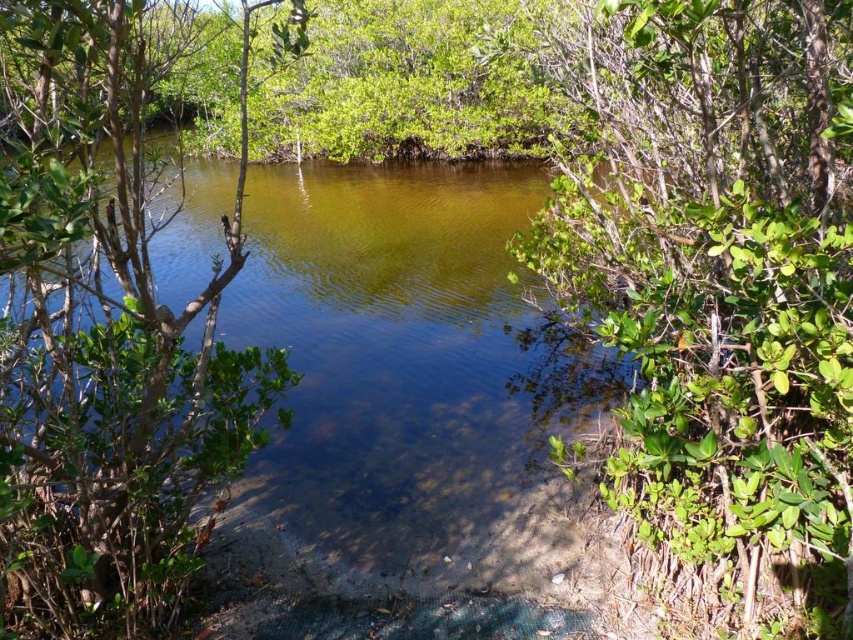
You are a hiker trying to cross the water area. You see the green leafy bush at center and the green leafy tree at left. Which one has a smaller width that might be easier to navigate around?

The green leafy bush at center has a smaller width than the green leafy tree at left, making it easier to navigate around.

You are a hiker who wants to cross the clear water at center to reach the green leafy tree at left. Based on the scene description, is the water shallow enough for you to walk through?

The clear water at center is above green leafy tree at left, which means the water is shallow enough to see the tree from above, so yes, the water is shallow enough for you to walk through.